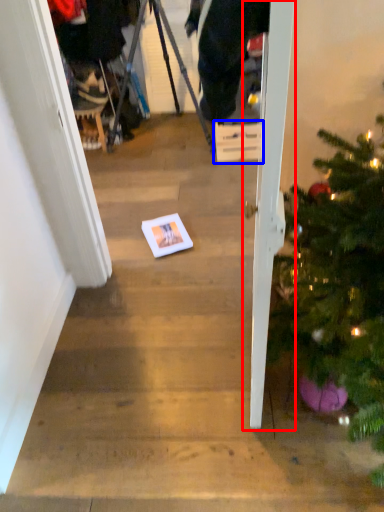
Question: Which object appears farthest to the camera in this image, door (highlighted by a red box) or cardboard box (highlighted by a blue box)?

Choices:
 (A) door
 (B) cardboard box

Answer: (B)